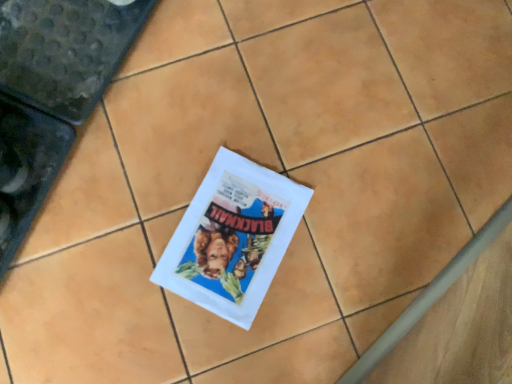
Measure the distance between white paper flyer at center and camera.

The distance of white paper flyer at center from camera is 80.09 centimeters.

The height and width of the screenshot is (384, 512). I want to click on white paper flyer at center, so click(232, 238).

What do you see at coordinates (232, 238) in the screenshot? I see `white paper flyer at center` at bounding box center [232, 238].

Identify the location of white paper flyer at center. (232, 238).